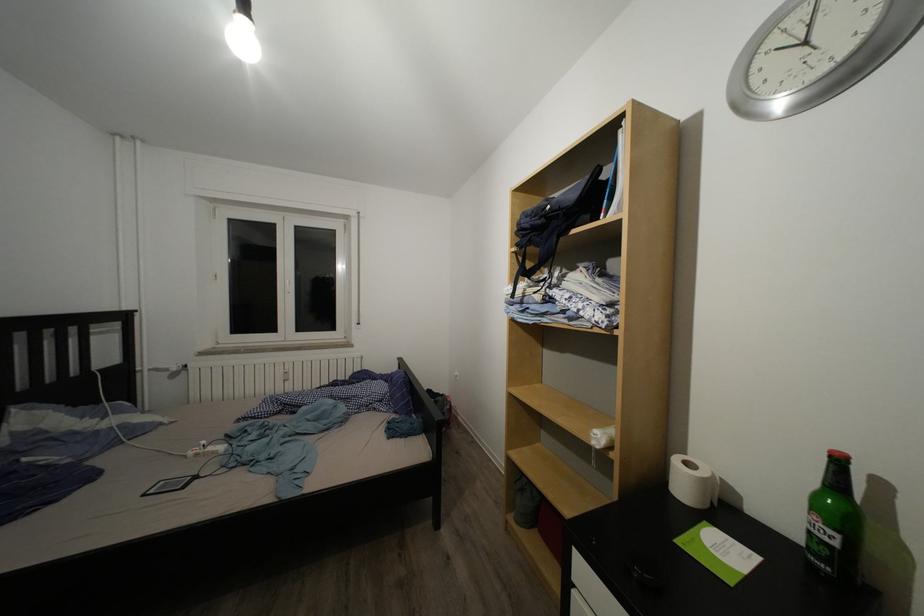
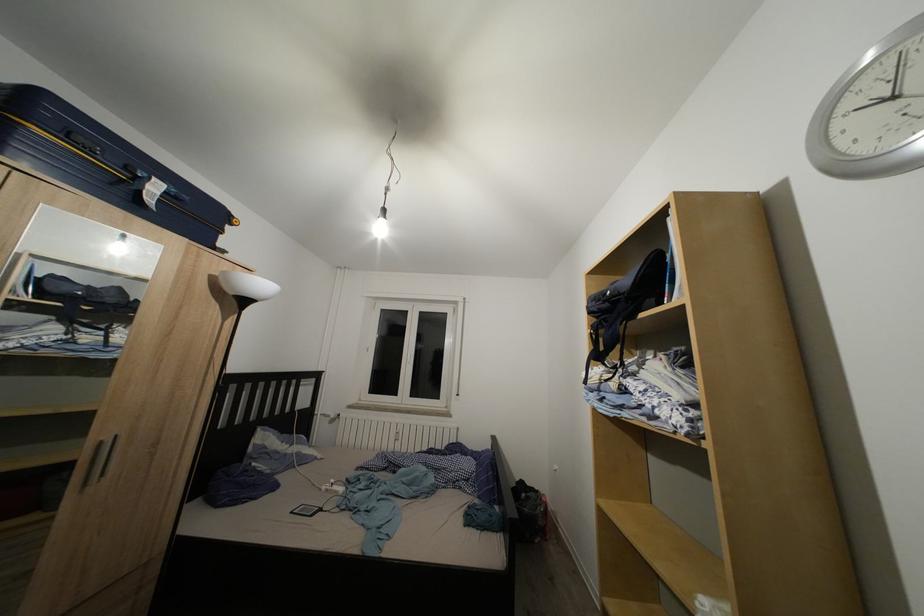
Find the pixel in the second image that matches point 535,233 in the first image.

(602, 315)